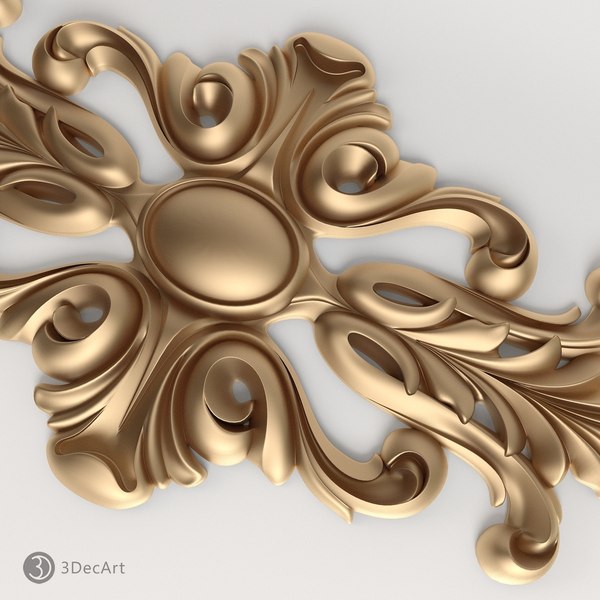
Where is `golden broze colred wall art`? golden broze colred wall art is located at coordinates (321, 295).